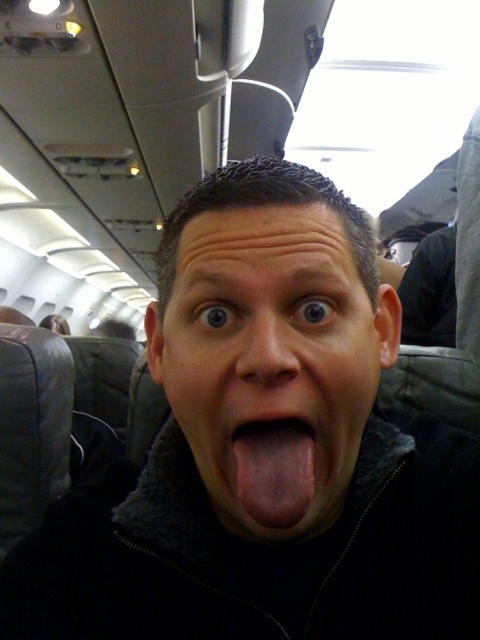
Question: Estimate the real-world distances between objects in this image. Which object is farther from the pink flesh-colored tongue at center?

Choices:
 (A) matte black face at center
 (B) smooth flesh nose at center

Answer: (A)

Question: Is matte black face at center above pink flesh-colored tongue at center?

Choices:
 (A) no
 (B) yes

Answer: (B)

Question: Is matte black face at center thinner than pink flesh-colored tongue at center?

Choices:
 (A) no
 (B) yes

Answer: (A)

Question: Can you confirm if matte black face at center is positioned below smooth flesh nose at center?

Choices:
 (A) yes
 (B) no

Answer: (A)

Question: Which object appears farthest from the camera in this image?

Choices:
 (A) pink flesh-colored tongue at center
 (B) matte black face at center
 (C) smooth flesh nose at center

Answer: (A)

Question: Which object is farther from the camera taking this photo?

Choices:
 (A) smooth flesh nose at center
 (B) matte black face at center
 (C) pink flesh-colored tongue at center

Answer: (C)